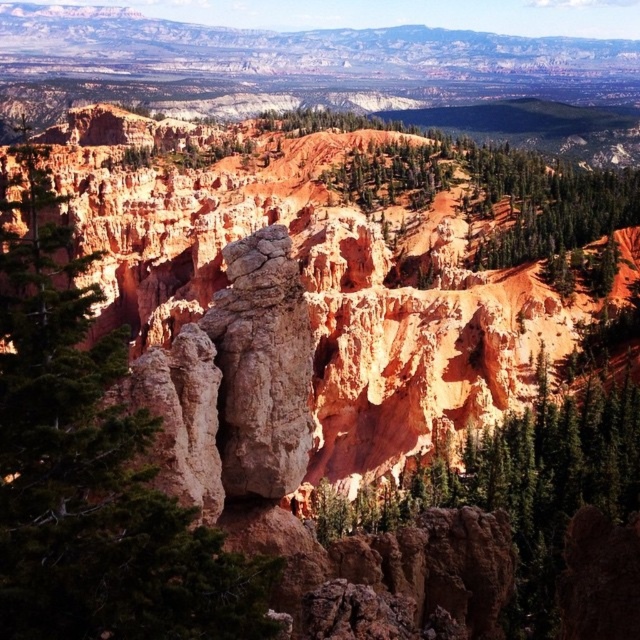
Image resolution: width=640 pixels, height=640 pixels. What are the coordinates of `green matte tree at left` in the screenshot? It's located at pos(90,464).

This screenshot has height=640, width=640. I want to click on green matte tree at left, so click(x=90, y=464).

Where is `green matte tree at left`? This screenshot has height=640, width=640. green matte tree at left is located at coordinates (90, 464).